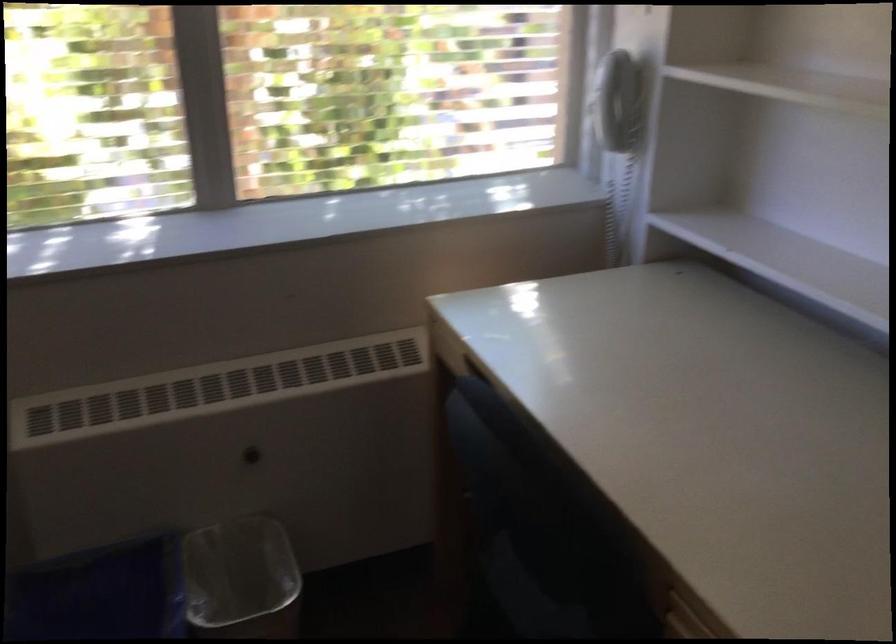
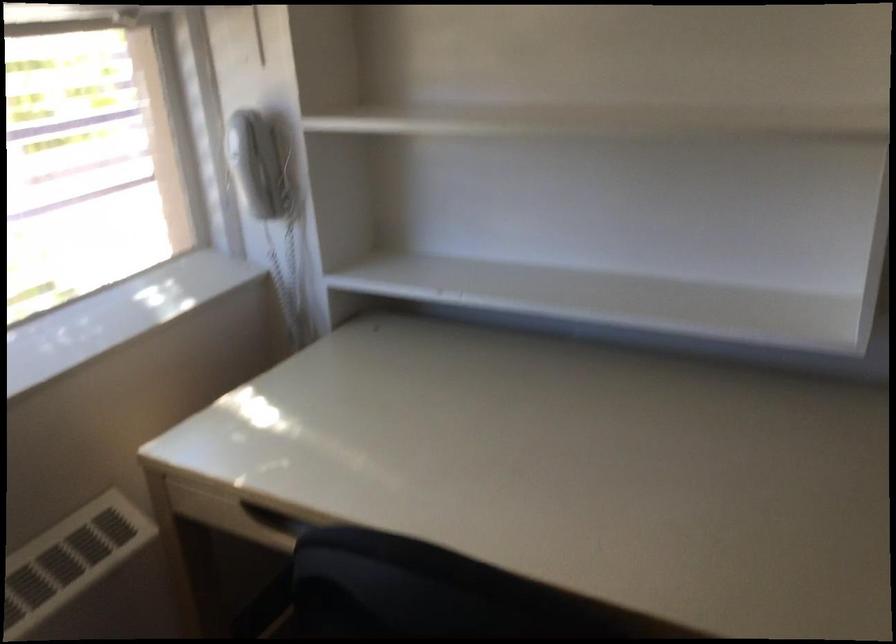
Where in the second image is the point corresponding to [463,365] from the first image?

(239, 516)